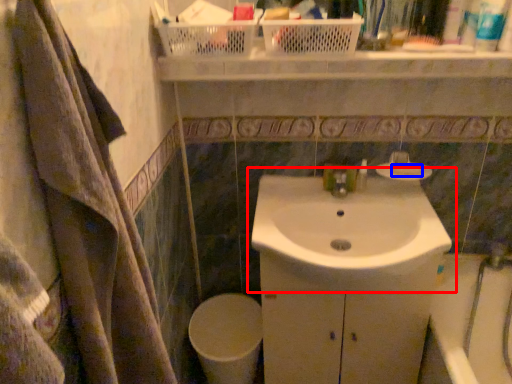
Question: Which of the following is the closest to the observer, sink (highlighted by a red box) or soap (highlighted by a blue box)?

Choices:
 (A) sink
 (B) soap

Answer: (A)